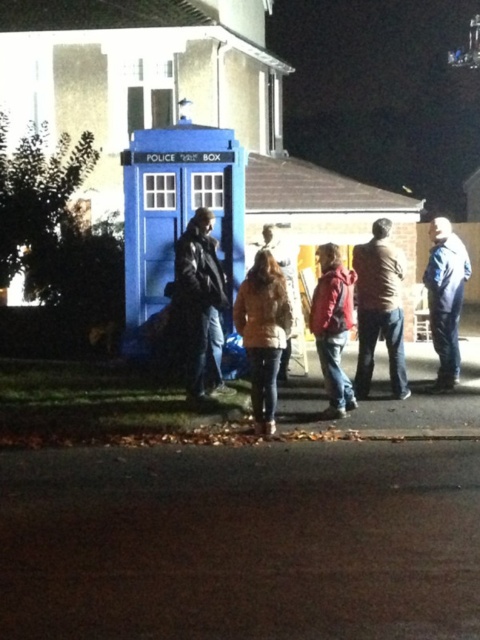
Does metallic blue police box at center have a smaller size compared to brown fuzzy coat at center?

No.

Does point (240, 208) lie behind point (240, 285)?

Yes, it is.

Where is `metallic blue police box at center`? metallic blue police box at center is located at coordinates (177, 216).

I want to click on brown textured sweater at center, so click(x=380, y=308).

This screenshot has width=480, height=640. Identify the location of brown textured sweater at center. (380, 308).

Which of these two, red leather jacket at center or blue fabric jacket at right, stands taller?

red leather jacket at center is taller.

Based on the photo, does red leather jacket at center have a smaller size compared to blue fabric jacket at right?

Incorrect, red leather jacket at center is not smaller in size than blue fabric jacket at right.

Is point (338, 376) more distant than point (448, 333)?

No, (338, 376) is closer to viewer.

You are a GUI agent. You are given a task and a screenshot of the screen. Output one action in this format:
    pyautogui.click(x=<x>, y=<y>)
    Task: Click on the red leather jacket at center
    This screenshot has width=480, height=640.
    Given the screenshot: What is the action you would take?
    pyautogui.click(x=333, y=326)